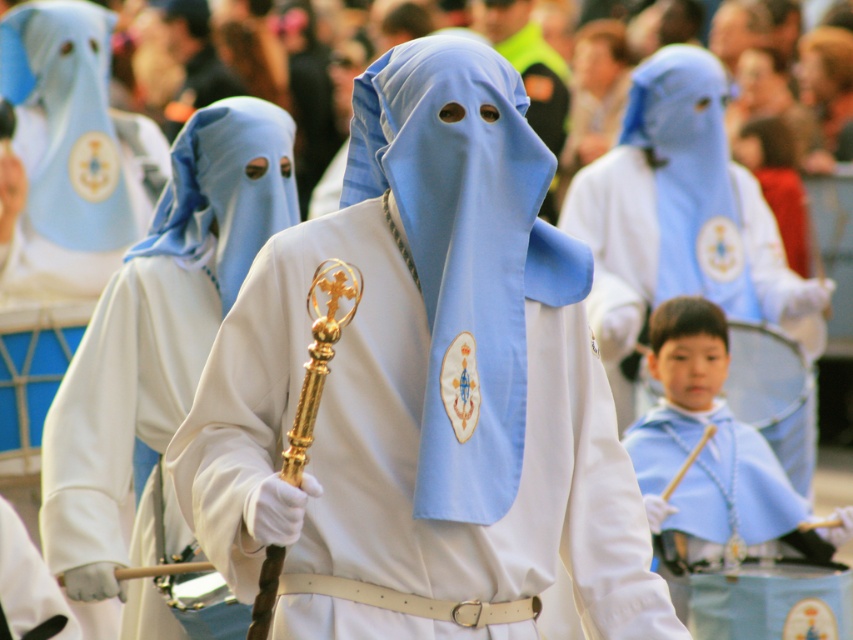
At what (x,y) coordinates should I click in order to perform the action: click on light blue fabric at lower right. Please return your answer as a coordinate pair (x, y). Looking at the image, I should click on (728, 499).

Can you confirm if light blue fabric at lower right is positioned to the right of matte blue fabric at center?

Yes, light blue fabric at lower right is to the right of matte blue fabric at center.

Between point (698, 525) and point (33, 150), which one is positioned in front?

Point (698, 525) is in front.

In order to click on light blue fabric at lower right in this screenshot , I will do `click(728, 499)`.

Between matte white robe at center and matte blue fabric at center, which one has less height?

matte blue fabric at center is shorter.

Is point (213, 260) positioned before point (45, 243)?

That is True.

Identify the location of matte white robe at center. (161, 321).

You are a GUI agent. You are given a task and a screenshot of the screen. Output one action in this format:
    pyautogui.click(x=<x>, y=<y>)
    Task: Click on the matte white robe at center
    Image resolution: width=853 pixels, height=640 pixels.
    Given the screenshot: What is the action you would take?
    pyautogui.click(x=161, y=321)

Which is above, matte white robe at center or light blue fabric at lower right?

matte white robe at center

Is point (86, 365) positioned after point (833, 595)?

No, it is not.

Where is `matte white robe at center`? The image size is (853, 640). matte white robe at center is located at coordinates (161, 321).